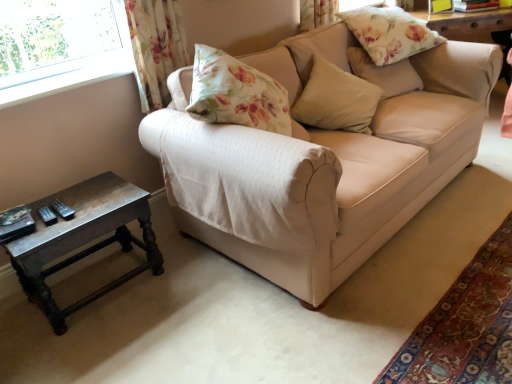
The height and width of the screenshot is (384, 512). I want to click on floral fabric pillow at upper right, placed as the second pillow when sorted from bottom to top, so click(385, 73).

This screenshot has width=512, height=384. What do you see at coordinates (381, 170) in the screenshot?
I see `beige fabric couch at center` at bounding box center [381, 170].

Describe the element at coordinates (336, 99) in the screenshot. I see `beige fabric pillow at center, which is the third pillow from top to bottom` at that location.

This screenshot has height=384, width=512. What are the coordinates of `beige fabric pillow at center, which is the third pillow from top to bottom` in the screenshot? It's located at (336, 99).

What do you see at coordinates (156, 47) in the screenshot? I see `floral fabric curtain at upper left` at bounding box center [156, 47].

The height and width of the screenshot is (384, 512). Identify the location of floral fabric pillow at upper right, placed as the second pillow when sorted from bottom to top. (385, 73).

Considering the sizes of objects beige fabric pillow at center, the 1th pillow in the bottom-to-top sequence, and floral fabric curtain at upper left in the image provided, who is thinner, beige fabric pillow at center, the 1th pillow in the bottom-to-top sequence, or floral fabric curtain at upper left?

floral fabric curtain at upper left is thinner.

Can you confirm if beige fabric pillow at center, which is the third pillow from top to bottom, is positioned to the right of floral fabric curtain at upper left?

Indeed, beige fabric pillow at center, which is the third pillow from top to bottom, is positioned on the right side of floral fabric curtain at upper left.

From the image's perspective, which object appears higher, beige fabric pillow at center, which is the third pillow from top to bottom, or floral fabric curtain at upper left?

floral fabric curtain at upper left.

Considering the positions of point (339, 117) and point (177, 14), is point (339, 117) closer or farther from the camera than point (177, 14)?

Clearly, point (339, 117) is closer to the camera than point (177, 14).

From a real-world perspective, count 1st pillows upward from the beige fabric couch at center and point to it. Please provide its 2D coordinates.

[(336, 99)]

From the image's perspective, is beige fabric pillow at center, the 1th pillow in the bottom-to-top sequence, positioned above or below beige fabric couch at center?

Based on their image positions, beige fabric pillow at center, the 1th pillow in the bottom-to-top sequence, is located above beige fabric couch at center.

Considering the sizes of objects beige fabric pillow at center, which is the third pillow from top to bottom, and beige fabric couch at center in the image provided, who is wider, beige fabric pillow at center, which is the third pillow from top to bottom, or beige fabric couch at center?

beige fabric couch at center is wider.

From a real-world perspective, between beige fabric pillow at center, which is the third pillow from top to bottom, and beige fabric couch at center, who is vertically higher?

beige fabric pillow at center, which is the third pillow from top to bottom.

Is the position of floral fabric pillow at upper right, the second pillow when ordered from top to bottom, more distant than that of beige fabric couch at center?

Yes, floral fabric pillow at upper right, the second pillow when ordered from top to bottom, is behind beige fabric couch at center.

Do you think floral fabric pillow at upper right, placed as the second pillow when sorted from bottom to top, is within beige fabric couch at center, or outside of it?

floral fabric pillow at upper right, placed as the second pillow when sorted from bottom to top, exists entirely within beige fabric couch at center.

Locate an element on the screen. The width and height of the screenshot is (512, 384). studio couch below the floral fabric pillow at upper right, the second pillow when ordered from top to bottom (from a real-world perspective) is located at coordinates (381, 170).

From a real-world perspective, is dark brown wooden table at lower left beneath beige fabric pillow at center, which is the third pillow from top to bottom?

Yes.

Does dark brown wooden table at lower left have a lesser height compared to beige fabric pillow at center, which is the third pillow from top to bottom?

No, dark brown wooden table at lower left is not shorter than beige fabric pillow at center, which is the third pillow from top to bottom.

What's the angular difference between dark brown wooden table at lower left and beige fabric pillow at center, the 1th pillow in the bottom-to-top sequence,'s facing directions?

There is a 33.2-degree angle between the facing directions of dark brown wooden table at lower left and beige fabric pillow at center, the 1th pillow in the bottom-to-top sequence.

Who is smaller, dark brown wooden table at lower left or beige fabric pillow at center, the 1th pillow in the bottom-to-top sequence?

With smaller size is beige fabric pillow at center, the 1th pillow in the bottom-to-top sequence.

Can you confirm if floral fabric curtain at upper left is taller than dark brown wooden table at lower left?

Correct, floral fabric curtain at upper left is much taller as dark brown wooden table at lower left.

Considering the relative sizes of floral fabric curtain at upper left and dark brown wooden table at lower left in the image provided, is floral fabric curtain at upper left wider than dark brown wooden table at lower left?

Incorrect, the width of floral fabric curtain at upper left does not surpass that of dark brown wooden table at lower left.

Considering the positions of point (166, 26) and point (93, 234), is point (166, 26) closer or farther from the camera than point (93, 234)?

Point (166, 26) is farther from the camera than point (93, 234).

Measure the distance from floral fabric curtain at upper left to dark brown wooden table at lower left.

The distance of floral fabric curtain at upper left from dark brown wooden table at lower left is 26.82 inches.

Does floral fabric pillow at upper right, the second pillow when ordered from top to bottom, have a greater width compared to beige fabric pillow at center, the 1th pillow in the bottom-to-top sequence?

In fact, floral fabric pillow at upper right, the second pillow when ordered from top to bottom, might be narrower than beige fabric pillow at center, the 1th pillow in the bottom-to-top sequence.

Considering the relative positions of floral fabric pillow at upper right, the second pillow when ordered from top to bottom, and beige fabric pillow at center, which is the third pillow from top to bottom, in the image provided, is floral fabric pillow at upper right, the second pillow when ordered from top to bottom, to the right of beige fabric pillow at center, which is the third pillow from top to bottom, from the viewer's perspective?

Indeed, floral fabric pillow at upper right, the second pillow when ordered from top to bottom, is positioned on the right side of beige fabric pillow at center, which is the third pillow from top to bottom.

From the image's perspective, is floral fabric pillow at upper right, placed as the second pillow when sorted from bottom to top, beneath beige fabric pillow at center, the 1th pillow in the bottom-to-top sequence?

No, from the image's perspective, floral fabric pillow at upper right, placed as the second pillow when sorted from bottom to top, is not below beige fabric pillow at center, the 1th pillow in the bottom-to-top sequence.

From the image's perspective, would you say dark brown wooden table at lower left is shown under floral fabric curtain at upper left?

Correct, dark brown wooden table at lower left appears lower than floral fabric curtain at upper left in the image.

Is dark brown wooden table at lower left positioned behind floral fabric curtain at upper left?

No, it is in front of floral fabric curtain at upper left.

In terms of width, does dark brown wooden table at lower left look wider or thinner when compared to floral fabric curtain at upper left?

Clearly, dark brown wooden table at lower left has more width compared to floral fabric curtain at upper left.

Find the location of a particular element. The image size is (512, 384). curtain positioned vertically above the beige fabric pillow at center, the 1th pillow in the bottom-to-top sequence (from a real-world perspective) is located at coordinates (156, 47).

Find the location of `the 1st pillow positioned above the beige fabric couch at center (from the image's perspective)`. the 1st pillow positioned above the beige fabric couch at center (from the image's perspective) is located at coordinates (336, 99).

From the image, which object appears to be nearer to floral fabric curtain at upper left, beige fabric pillow at center, the 1th pillow in the bottom-to-top sequence, or beige fabric couch at center?

beige fabric pillow at center, the 1th pillow in the bottom-to-top sequence, lies closer to floral fabric curtain at upper left than the other object.

From the image, which object appears to be farther from floral fabric curtain at upper left, floral fabric pillow at upper right, which is the third pillow from bottom to top, or floral fabric pillow at upper right, placed as the second pillow when sorted from bottom to top?

Based on the image, floral fabric pillow at upper right, which is the third pillow from bottom to top, appears to be further to floral fabric curtain at upper left.

Based on their spatial positions, is floral fabric curtain at upper left or floral fabric pillow at upper right, placed as the second pillow when sorted from bottom to top, closer to beige fabric couch at center?

floral fabric pillow at upper right, placed as the second pillow when sorted from bottom to top.

Estimate the real-world distances between objects in this image. Which object is closer to dark brown wooden table at lower left, floral fabric pillow at upper right, the second pillow when ordered from top to bottom, or floral fabric curtain at upper left?

floral fabric curtain at upper left.

Which object lies further to the anchor point floral fabric curtain at upper left, floral fabric pillow at upper right, placed as the second pillow when sorted from bottom to top, or beige fabric couch at center?

floral fabric pillow at upper right, placed as the second pillow when sorted from bottom to top, is further to floral fabric curtain at upper left.

In the scene shown: Considering their positions, is floral fabric pillow at upper right, placed as the second pillow when sorted from bottom to top, positioned closer to beige fabric couch at center than floral fabric curtain at upper left?

floral fabric pillow at upper right, placed as the second pillow when sorted from bottom to top, is positioned closer to the anchor beige fabric couch at center.

Which object lies nearer to the anchor point dark brown wooden table at lower left, beige fabric pillow at center, which is the third pillow from top to bottom, or floral fabric pillow at upper right, the second pillow when ordered from top to bottom?

Among the two, beige fabric pillow at center, which is the third pillow from top to bottom, is located nearer to dark brown wooden table at lower left.

Based on their spatial positions, is beige fabric couch at center or dark brown wooden table at lower left closer to floral fabric pillow at upper right, the second pillow when ordered from top to bottom?

beige fabric couch at center is positioned closer to the anchor floral fabric pillow at upper right, the second pillow when ordered from top to bottom.

This screenshot has width=512, height=384. In order to click on pillow between floral fabric curtain at upper left and beige fabric couch at center from left to right in this screenshot , I will do `click(336, 99)`.

This screenshot has height=384, width=512. I want to click on pillow positioned between beige fabric couch at center and floral fabric pillow at upper right, the first pillow in the top-to-bottom sequence, from near to far, so click(x=336, y=99).

Where is `studio couch between dark brown wooden table at lower left and floral fabric pillow at upper right, the first pillow in the top-to-bottom sequence`? This screenshot has height=384, width=512. studio couch between dark brown wooden table at lower left and floral fabric pillow at upper right, the first pillow in the top-to-bottom sequence is located at coordinates (381, 170).

Where is `pillow between floral fabric pillow at upper right, the first pillow in the top-to-bottom sequence, and beige fabric pillow at center, which is the third pillow from top to bottom, vertically`? The height and width of the screenshot is (384, 512). pillow between floral fabric pillow at upper right, the first pillow in the top-to-bottom sequence, and beige fabric pillow at center, which is the third pillow from top to bottom, vertically is located at coordinates (385, 73).